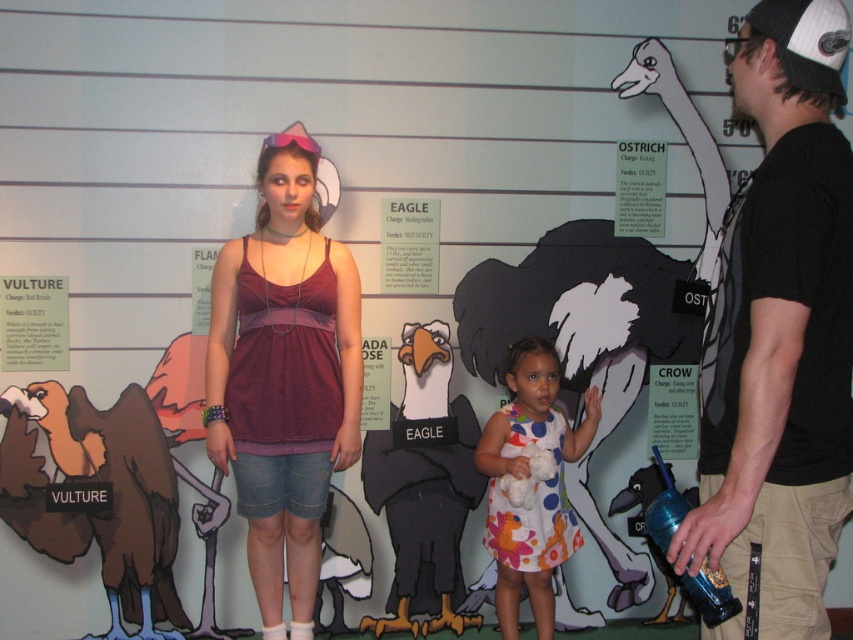
Question: Does black t-shirt at center appear under brown matte vulture at left?

Choices:
 (A) no
 (B) yes

Answer: (A)

Question: Can you confirm if white polka dot dress at center is positioned above white paper ostrich at upper right?

Choices:
 (A) no
 (B) yes

Answer: (A)

Question: Among these objects, which one is farthest from the camera?

Choices:
 (A) white fluffy ostrich at center
 (B) white paper ostrich at upper right
 (C) matte purple tank top at center
 (D) white polka dot dress at center

Answer: (B)

Question: Which object is closer to the camera taking this photo?

Choices:
 (A) white fluffy ostrich at center
 (B) white paper ostrich at upper right
 (C) matte paper eagle at center
 (D) black t-shirt at center

Answer: (D)

Question: Does brown matte vulture at left lie behind matte paper vulture at left?

Choices:
 (A) yes
 (B) no

Answer: (A)

Question: Which point is farther to the camera?

Choices:
 (A) (592, 221)
 (B) (418, 388)
 (C) (509, 602)

Answer: (A)